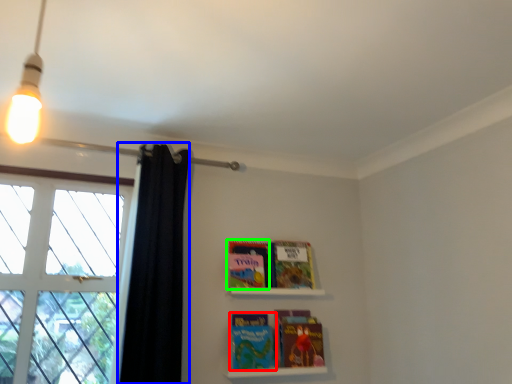
Question: Which is farther away from paperback book (highlighted by a red box)? shower curtain (highlighted by a blue box) or paperback book (highlighted by a green box)?

Choices:
 (A) shower curtain
 (B) paperback book

Answer: (A)